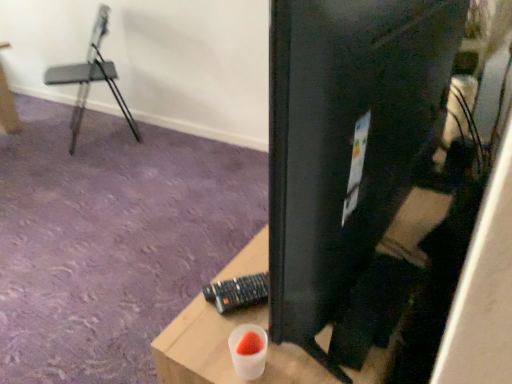
The image size is (512, 384). What are the coordinates of `blank area to the left of metallic gray armchair at left` in the screenshot? It's located at (34, 134).